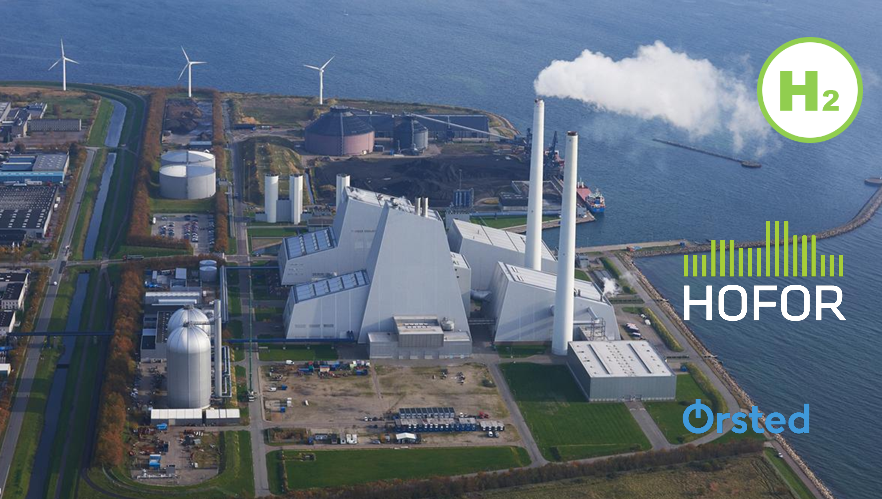
Find the location of a particular element. This screenshot has height=499, width=882. skylights is located at coordinates (327, 283), (314, 241).